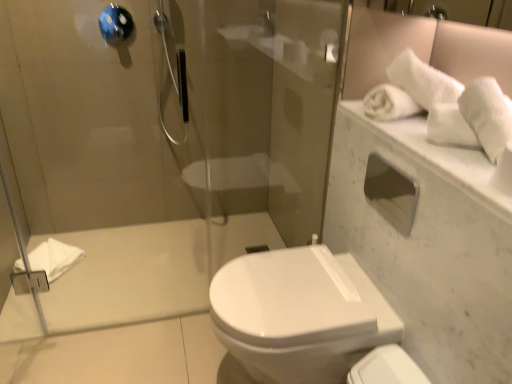
Question: Is point (490, 188) closer or farther from the camera than point (485, 84)?

Choices:
 (A) farther
 (B) closer

Answer: (B)

Question: Is white marble mirror at upper right in front of or behind white soft towel at upper right, which is the 1th bath towel in top-to-bottom order, in the image?

Choices:
 (A) behind
 (B) front

Answer: (B)

Question: Which is farther from the matte silver showerhead at upper center?

Choices:
 (A) white matte towel at left, the 2th bath towel in the right-to-left sequence
 (B) blue glossy towel bar at upper left
 (C) white soft towel at upper right, arranged as the 1th bath towel when viewed from the front
 (D) white glossy bidet at center
 (E) white marble mirror at upper right

Answer: (C)

Question: Estimate the real-world distances between objects in this image. Which object is closer to the white glossy bidet at center?

Choices:
 (A) matte silver showerhead at upper center
 (B) white glossy toilet at lower right
 (C) blue glossy towel bar at upper left
 (D) white matte towel at left, marked as the first bath towel in a bottom-to-top arrangement
 (E) white marble mirror at upper right

Answer: (B)